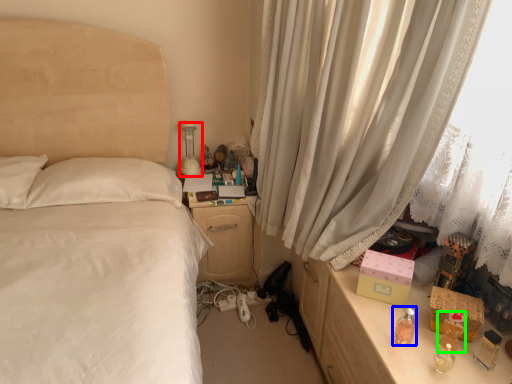
Question: Which object is positioned farthest from table lamp (highlighted by a red box)? Select from perfume (highlighted by a blue box) and perfume (highlighted by a green box).

Choices:
 (A) perfume
 (B) perfume

Answer: (B)